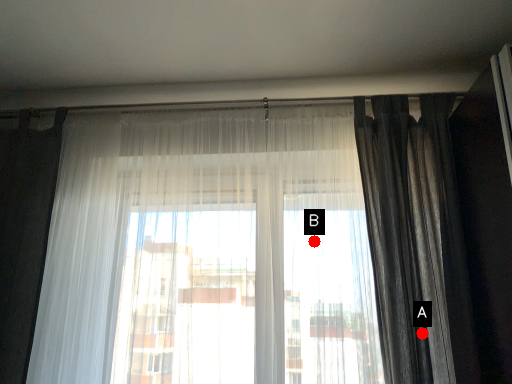
Question: Two points are circled on the image, labeled by A and B beside each circle. Which of the following is the closest to the observer?

Choices:
 (A) A is closer
 (B) B is closer

Answer: (A)